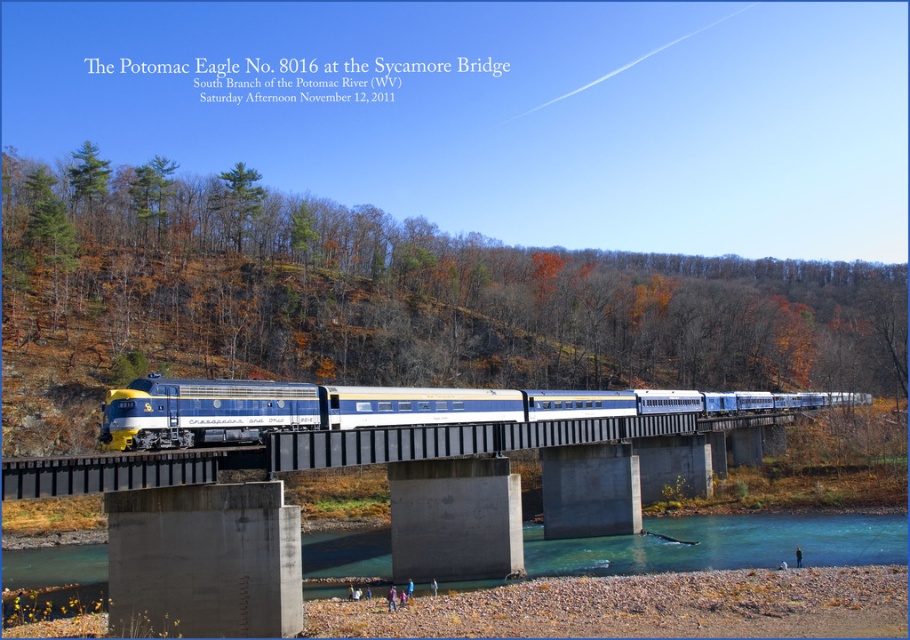
You are a railway inspector checking the train crossing. The blue polished metal train at center is approaching the concrete bridge at center. According to safety regulations, the bridge must be at least as wide as the train to allow safe passage. Is the current bridge width compliant with safety standards?

The blue polished metal train at center has a width larger than the concrete bridge at center, so the bridge is not compliant with safety standards as it is narrower than the train.

You are standing at the Sycamore Bridge and want to take a photo of the Potomac Eagle No. 8016 train. You notice two points marked on the bridge. Which point, point [339,417] or point [174,477], is closer to your camera position?

Point [174,477] is closer to the camera position because it is less further than point [339,417].

You are a photographer planning to capture the blue polished metal train at center and the concrete bridge at center in a single frame. Based on the scene described, which object will occupy more of the visual space in the photo?

The concrete bridge at center occupies more visual space than the blue polished metal train at center because the train occupies less space than the bridge.